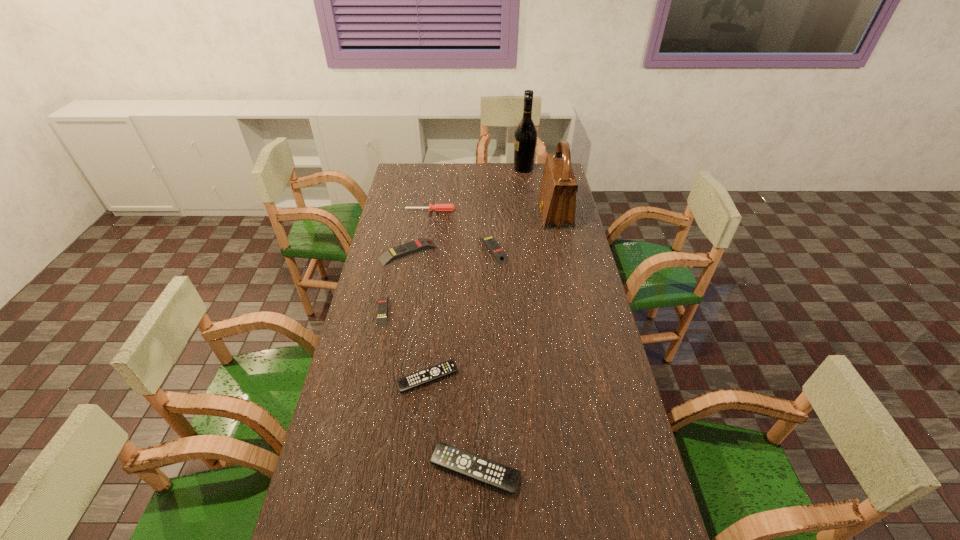
You are a GUI agent. You are given a task and a screenshot of the screen. Output one action in this format:
    pyautogui.click(x=<x>, y=<y>)
    Task: Click on the second nearest object
    The width and height of the screenshot is (960, 540).
    Given the screenshot: What is the action you would take?
    pyautogui.click(x=430, y=374)

You are a GUI agent. You are given a task and a screenshot of the screen. Output one action in this format:
    pyautogui.click(x=<x>, y=<y>)
    Task: Click on the second nearest remote control
    
    Given the screenshot: What is the action you would take?
    pyautogui.click(x=430, y=374)

Identify the location of free space located 0.370m on the label of the farthest object. (443, 168).

You are a GUI agent. You are given a task and a screenshot of the screen. Output one action in this format:
    pyautogui.click(x=<x>, y=<y>)
    Task: Click on the vacant area situated 0.400m on the label of the farthest object
    This screenshot has width=960, height=540.
    Given the screenshot: What is the action you would take?
    pyautogui.click(x=437, y=168)

The height and width of the screenshot is (540, 960). What are the coordinates of `free point located on the label of the farthest object` in the screenshot? It's located at (439, 168).

Identify the location of vacant region located on the front flap of the shoulder bag. This screenshot has width=960, height=540. (483, 214).

Locate an element on the screen. The width and height of the screenshot is (960, 540). free location located 0.270m on the front flap of the shoulder bag is located at coordinates (480, 214).

The height and width of the screenshot is (540, 960). What are the coordinates of `vacant space located on the front flap of the shoulder bag` in the screenshot? It's located at (487, 214).

You are a GUI agent. You are given a task and a screenshot of the screen. Output one action in this format:
    pyautogui.click(x=<x>, y=<y>)
    Task: Click on the vacant space positioned 0.180m on the front of the red screwdriver
    This screenshot has height=540, width=960.
    Given the screenshot: What is the action you would take?
    pyautogui.click(x=426, y=237)

The width and height of the screenshot is (960, 540). I want to click on vacant space located 0.230m on the front of the biggest yellow remote control, so tap(397, 308).